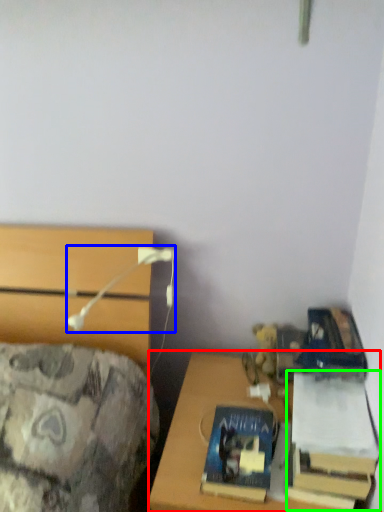
Question: Considering the real-world distances, which object is farthest from desk (highlighted by a red box)? table lamp (highlighted by a blue box) or book (highlighted by a green box)?

Choices:
 (A) table lamp
 (B) book

Answer: (A)